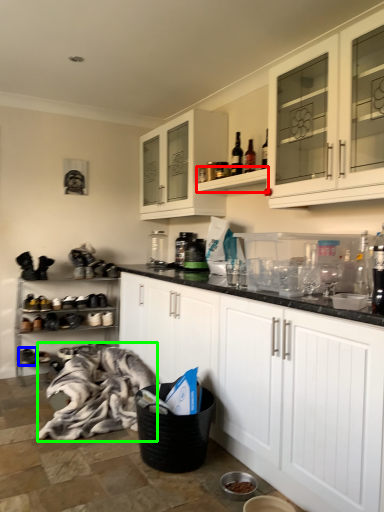
Question: Considering the real-world distances, which object is farthest from shelf (highlighted by a red box)? footwear (highlighted by a blue box) or blanket (highlighted by a green box)?

Choices:
 (A) footwear
 (B) blanket

Answer: (A)